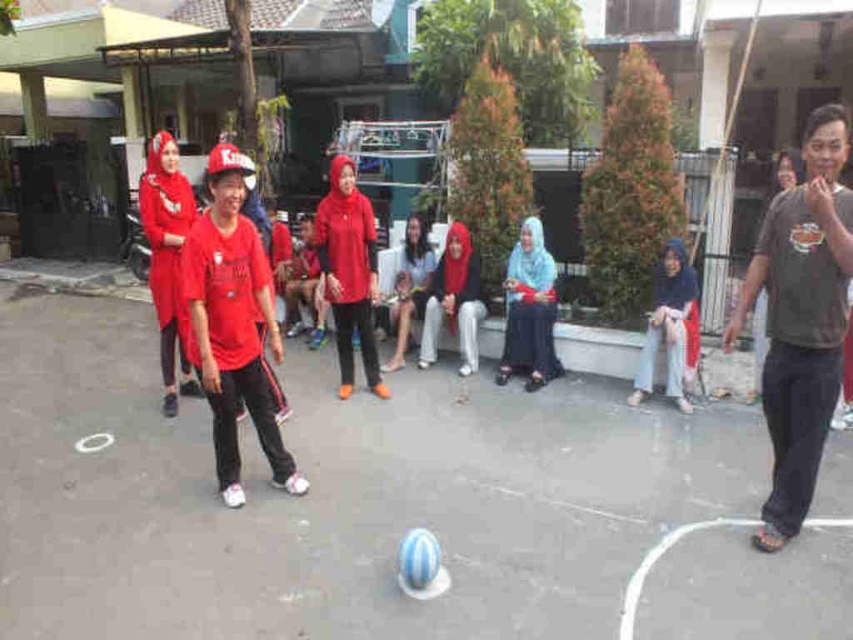
Is dark gray t-shirt at right thinner than matte red shirt at center?

Yes.

Does dark gray t-shirt at right come in front of matte red shirt at center?

Yes.

At what (x,y) coordinates should I click in order to perform the action: click on dark gray t-shirt at right. Please return your answer as a coordinate pair (x, y). The width and height of the screenshot is (853, 640). Looking at the image, I should click on (801, 317).

At what (x,y) coordinates should I click in order to perform the action: click on dark gray t-shirt at right. Please return your answer as a coordinate pair (x, y). Looking at the image, I should click on (801, 317).